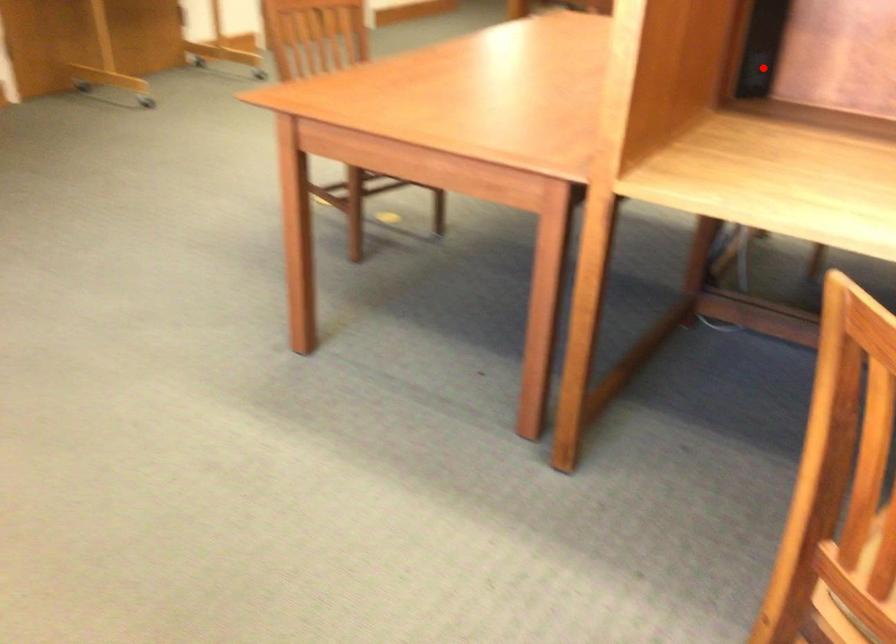
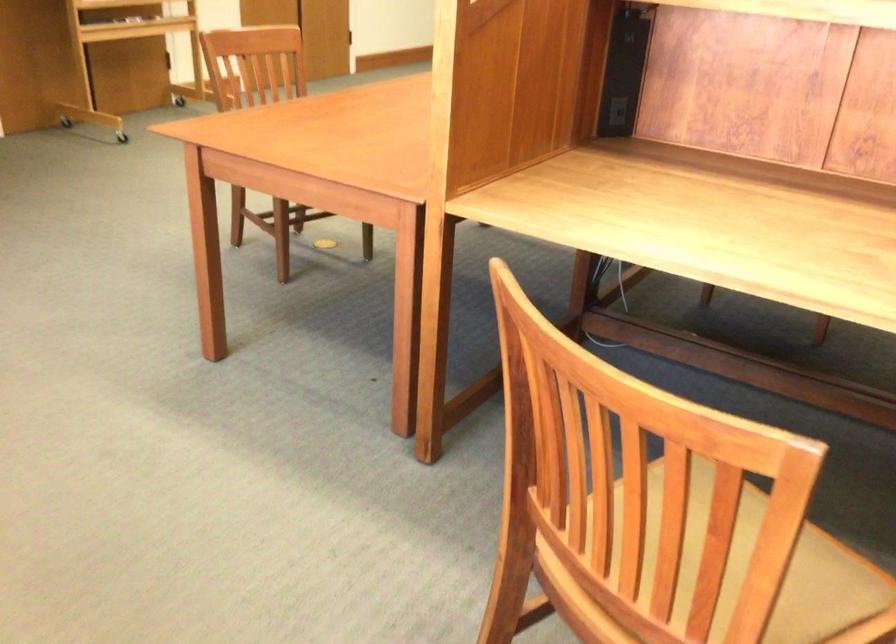
Where in the second image is the point corresponding to the highlighted location from the first image?

(616, 111)